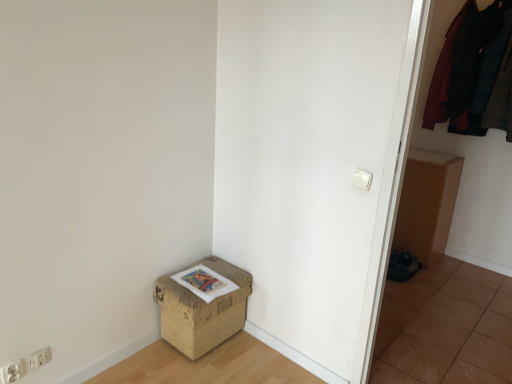
Image resolution: width=512 pixels, height=384 pixels. Identify the location of white plastic light switch at upper right. (362, 179).

Image resolution: width=512 pixels, height=384 pixels. Describe the element at coordinates (362, 179) in the screenshot. I see `white plastic light switch at upper right` at that location.

Where is `brown cardboard box at lower left`? The image size is (512, 384). brown cardboard box at lower left is located at coordinates 202,310.

Measure the distance between point (32, 357) and camera.

The distance of point (32, 357) from camera is 5.67 feet.

The height and width of the screenshot is (384, 512). Describe the element at coordinates (501, 98) in the screenshot. I see `dark woolen sweater at upper right, marked as the second clothing in a left-to-right arrangement` at that location.

The height and width of the screenshot is (384, 512). Identify the location of dark woolen sweater at upper right, the second clothing in the right-to-left sequence. (468, 67).

Describe the element at coordinates (445, 327) in the screenshot. I see `brown tile at lower right` at that location.

Locate an element on the screen. white plastic light switch at upper right is located at coordinates (362, 179).

Can we say dark woolen sweater at upper right, the second clothing in the right-to-left sequence, lies outside brown tile at lower right?

That's correct, dark woolen sweater at upper right, the second clothing in the right-to-left sequence, is outside of brown tile at lower right.

From a real-world perspective, which object rests below the other?

brown tile at lower right is physically lower.

Could you tell me if dark woolen sweater at upper right, the second clothing in the right-to-left sequence, is turned towards brown tile at lower right?

No, dark woolen sweater at upper right, the second clothing in the right-to-left sequence, is not oriented towards brown tile at lower right.

You are a GUI agent. You are given a task and a screenshot of the screen. Output one action in this format:
    pyautogui.click(x=<x>, y=<y>)
    Task: Click on the tile on the left of dark woolen sweater at upper right, marked as the 1th clothing in a left-to-right arrangement
    The image size is (512, 384).
    Given the screenshot: What is the action you would take?
    pyautogui.click(x=445, y=327)

From the image's perspective, which is below, dark woolen sweater at upper right, marked as the second clothing in a left-to-right arrangement, or brown cardboard box at lower left?

brown cardboard box at lower left.

From a real-world perspective, is dark woolen sweater at upper right, which is the 1th clothing from right to left, positioned above or below brown cardboard box at lower left?

dark woolen sweater at upper right, which is the 1th clothing from right to left, is above brown cardboard box at lower left.

Does dark woolen sweater at upper right, marked as the second clothing in a left-to-right arrangement, have a greater height compared to white plastic electric outlet at lower left, the 2th electric outlet positioned from the right?

Yes.

Based on their positions, is dark woolen sweater at upper right, marked as the second clothing in a left-to-right arrangement, located to the left or right of white plastic electric outlet at lower left, the 2th electric outlet positioned from the right?

In the image, dark woolen sweater at upper right, marked as the second clothing in a left-to-right arrangement, appears on the right side of white plastic electric outlet at lower left, the 2th electric outlet positioned from the right.

From the dark woolen sweater at upper right, which is the 1th clothing from right to left, count 2nd electric outlets forward and point to it. Please provide its 2D coordinates.

[(11, 372)]

Which object is positioned more to the left, white plastic electric outlet at lower left, placed as the first electric outlet when sorted from left to right, or brown cardboard box at lower left?

From the viewer's perspective, white plastic electric outlet at lower left, placed as the first electric outlet when sorted from left to right, appears more on the left side.

Measure the distance between white plastic electric outlet at lower left, which appears as the 1th electric outlet when viewed from the front, and brown cardboard box at lower left.

They are 31.33 inches apart.

Considering the positions of point (15, 379) and point (168, 342), is point (15, 379) closer or farther from the camera than point (168, 342)?

Point (15, 379) is positioned closer to the camera compared to point (168, 342).

From the image's perspective, is white plastic electric outlet at lower left, the 2th electric outlet positioned from the back, on brown cardboard box at lower left?

No, from the image's perspective, white plastic electric outlet at lower left, the 2th electric outlet positioned from the back, is not over brown cardboard box at lower left.

Which object is closer to the camera taking this photo, white plastic electric outlet at lower left, the 2th electric outlet positioned from the right, or white plastic electric outlet at lower left, positioned as the 1th electric outlet in back-to-front order?

white plastic electric outlet at lower left, the 2th electric outlet positioned from the right, is more forward.

Considering the positions of points (18, 372) and (36, 355), is point (18, 372) closer to camera compared to point (36, 355)?

Yes, it is.

From a real-world perspective, between white plastic electric outlet at lower left, which appears as the 1th electric outlet when viewed from the front, and white plastic electric outlet at lower left, positioned as the second electric outlet in front-to-back order, who is vertically lower?

white plastic electric outlet at lower left, positioned as the second electric outlet in front-to-back order.

Is white plastic electric outlet at lower left, the 2th electric outlet positioned from the back, at the right side of white plastic electric outlet at lower left, positioned as the second electric outlet in front-to-back order?

In fact, white plastic electric outlet at lower left, the 2th electric outlet positioned from the back, is to the left of white plastic electric outlet at lower left, positioned as the second electric outlet in front-to-back order.

How far apart are dark woolen sweater at upper right, marked as the second clothing in a left-to-right arrangement, and brown tile at lower right?

dark woolen sweater at upper right, marked as the second clothing in a left-to-right arrangement, and brown tile at lower right are 1.31 meters apart.

Between dark woolen sweater at upper right, marked as the second clothing in a left-to-right arrangement, and brown tile at lower right, which one has less height?

brown tile at lower right.

Which is more to the left, dark woolen sweater at upper right, marked as the second clothing in a left-to-right arrangement, or brown tile at lower right?

Positioned to the left is brown tile at lower right.

Which is correct: brown tile at lower right is inside brown cardboard box at lower right, or outside of it?

brown tile at lower right is not enclosed by brown cardboard box at lower right.

From the image's perspective, which is above, brown tile at lower right or brown cardboard box at lower right?

brown cardboard box at lower right.

Which is closer to the camera, (471, 353) or (437, 238)?

Point (471, 353) is positioned closer to the camera compared to point (437, 238).

Is the depth of brown tile at lower right less than that of brown cardboard box at lower right?

Yes.

Image resolution: width=512 pixels, height=384 pixels. Identify the location of clothing that is the 2nd object located behind the brown tile at lower right. (468, 67).

Where is `box lying in front of the dark woolen sweater at upper right, marked as the second clothing in a left-to-right arrangement`? box lying in front of the dark woolen sweater at upper right, marked as the second clothing in a left-to-right arrangement is located at coordinates (202, 310).

Considering their positions, is white plastic electric outlet at lower left, positioned as the 1th electric outlet in right-to-left order, positioned closer to dark woolen sweater at upper right, marked as the 1th clothing in a left-to-right arrangement, than brown cardboard box at lower right?

brown cardboard box at lower right is closer to dark woolen sweater at upper right, marked as the 1th clothing in a left-to-right arrangement.

Considering their positions, is brown tile at lower right positioned closer to white plastic light switch at upper right than brown cardboard box at lower right?

brown tile at lower right is closer to white plastic light switch at upper right.

When comparing their distances from brown cardboard box at lower right, does brown tile at lower right or dark woolen sweater at upper right, marked as the second clothing in a left-to-right arrangement, seem further?

brown tile at lower right is further to brown cardboard box at lower right.

When comparing their distances from dark woolen sweater at upper right, the second clothing in the right-to-left sequence, does white plastic electric outlet at lower left, positioned as the 1th electric outlet in right-to-left order, or brown cardboard box at lower left seem closer?

brown cardboard box at lower left.

From the picture: Based on their spatial positions, is dark woolen sweater at upper right, marked as the 1th clothing in a left-to-right arrangement, or white plastic electric outlet at lower left, positioned as the second electric outlet in front-to-back order, further from brown tile at lower right?

white plastic electric outlet at lower left, positioned as the second electric outlet in front-to-back order, is further to brown tile at lower right.

Considering their positions, is brown cardboard box at lower right positioned closer to white plastic light switch at upper right than brown cardboard box at lower left?

brown cardboard box at lower left is positioned closer to the anchor white plastic light switch at upper right.

Considering their positions, is dark woolen sweater at upper right, which is the 1th clothing from right to left, positioned further to white plastic light switch at upper right than brown cardboard box at lower right?

brown cardboard box at lower right is positioned further to the anchor white plastic light switch at upper right.

Which object lies further to the anchor point dark woolen sweater at upper right, marked as the 1th clothing in a left-to-right arrangement, brown tile at lower right or white plastic light switch at upper right?

white plastic light switch at upper right lies further to dark woolen sweater at upper right, marked as the 1th clothing in a left-to-right arrangement, than the other object.

This screenshot has width=512, height=384. Identify the location of box situated between white plastic electric outlet at lower left, the 2th electric outlet positioned from the back, and white plastic light switch at upper right from left to right. (202, 310).

The image size is (512, 384). I want to click on clothing between dark woolen sweater at upper right, marked as the 1th clothing in a left-to-right arrangement, and brown tile at lower right, in the vertical direction, so click(x=501, y=98).

You are a GUI agent. You are given a task and a screenshot of the screen. Output one action in this format:
    pyautogui.click(x=<x>, y=<y>)
    Task: Click on the cardboard box located between white plastic electric outlet at lower left, the 2th electric outlet positioned from the back, and dark woolen sweater at upper right, the second clothing in the right-to-left sequence, in the left-right direction
    
    Given the screenshot: What is the action you would take?
    pyautogui.click(x=426, y=204)

Find the location of a particular element. Image resolution: width=512 pixels, height=384 pixels. tile situated between white plastic electric outlet at lower left, the 2th electric outlet positioned from the back, and dark woolen sweater at upper right, marked as the second clothing in a left-to-right arrangement, from left to right is located at coordinates (445, 327).